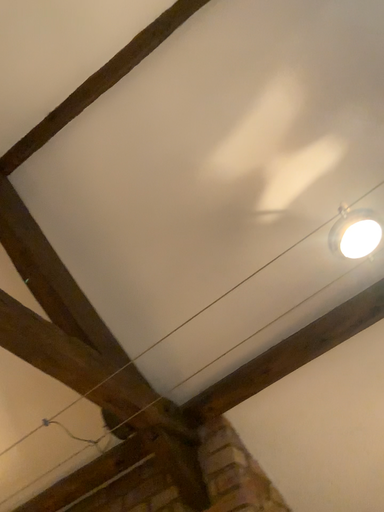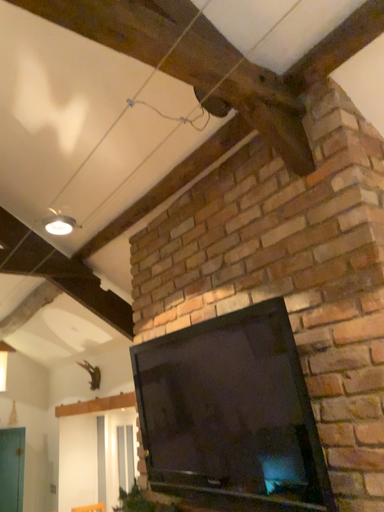
Question: How did the camera likely rotate when shooting the video?

Choices:
 (A) rotated right
 (B) rotated left

Answer: (B)